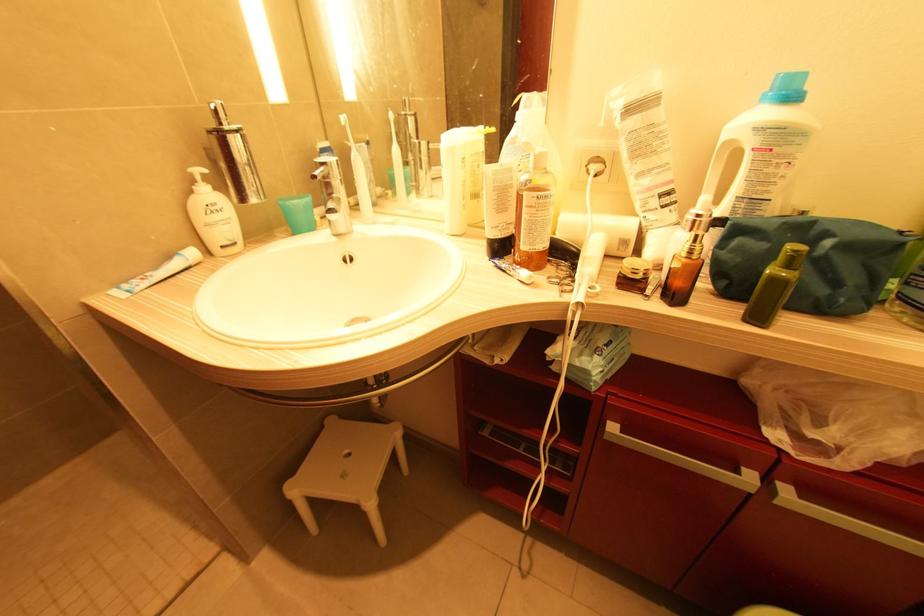
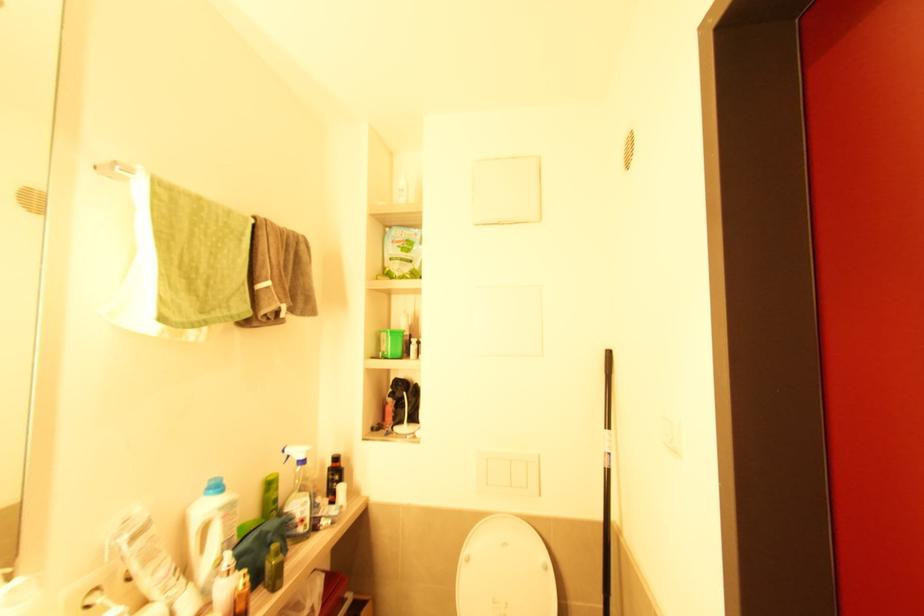
In the second image, find the point that corresponds to pixel 755 150 in the first image.

(224, 519)